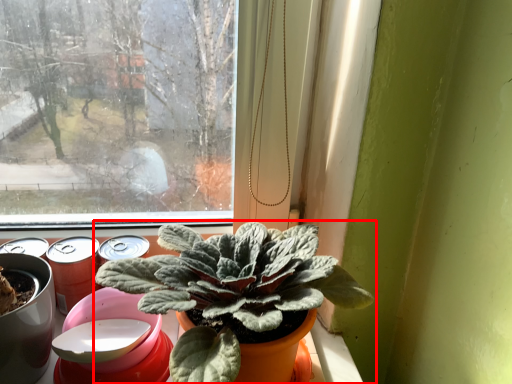
Question: From the image's perspective, where is houseplant (annotated by the red box) located relative to beer?

Choices:
 (A) below
 (B) above

Answer: (A)